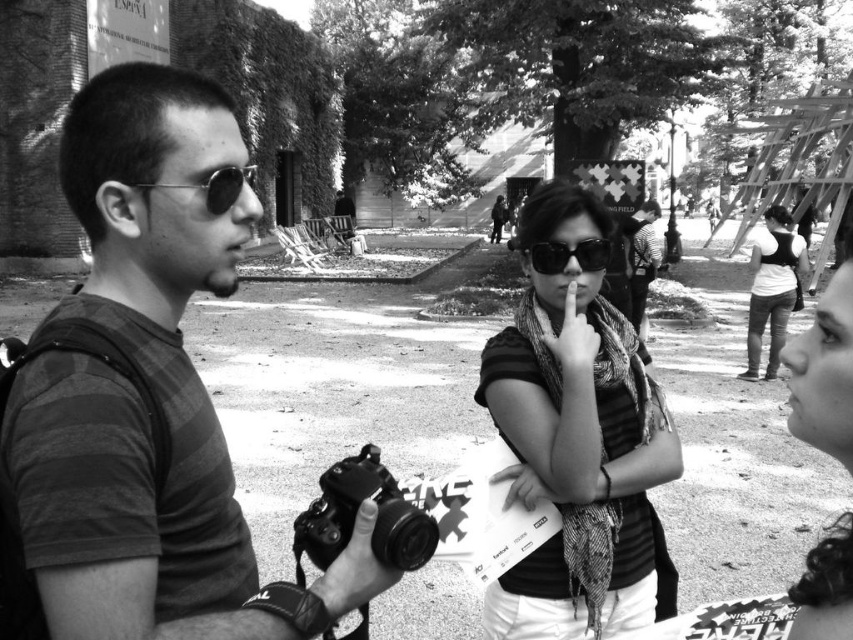
You are standing in the scene and want to place a small decoration exactly at point (219, 637). If you are 6 feet tall, can you see the decoration without bending down?

The distance of point (219, 637) from viewer is 4.00 feet. Since the decoration is placed at that point, and you are 6 feet tall, you can see it without bending down as it is within your line of sight at that distance.

You are a photographer trying to frame a shot in the scene. You want to include both the white matte shirt at right and the matte black sunglasses at center. Which object should you adjust your camera to focus on first to ensure both fit in the frame?

The white matte shirt at right is wider than the matte black sunglasses at center, so focus on the wider white matte shirt at right first to ensure both fit in the frame.

Consider the image. You are a photographer trying to decide whether to carry both the matte black camera at center and the matte black sunglasses at center in your small camera bag. The bag can only fit items up to the size of the sunglasses. Can you fit both items in the bag?

The matte black camera at center is larger than the matte black sunglasses at center. Since the bag can only fit items up to the size of the sunglasses, the camera cannot fit, so you cannot carry both items in the bag.